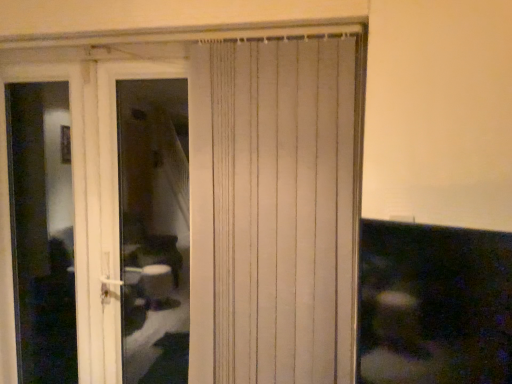
Image resolution: width=512 pixels, height=384 pixels. What do you see at coordinates (77, 216) in the screenshot?
I see `transparent glass screen door at left` at bounding box center [77, 216].

Where is `white textured curtain at center`? white textured curtain at center is located at coordinates (272, 212).

Describe the element at coordinates (154, 229) in the screenshot. I see `white plastic door at left` at that location.

Locate an element on the screen. transparent glass screen door at left is located at coordinates (77, 216).

Is white plastic door at left facing away from transparent glass screen door at left?

That's not correct — white plastic door at left is not looking away from transparent glass screen door at left.

Is white plastic door at left smaller than transparent glass screen door at left?

Actually, white plastic door at left might be larger than transparent glass screen door at left.

Is white plastic door at left next to transparent glass screen door at left?

No, white plastic door at left is not touching transparent glass screen door at left.

Does point (105, 176) come farther from viewer compared to point (219, 282)?

Yes, it is.

Measure the distance between transparent glass screen door at left and white textured curtain at center.

A distance of 69.51 centimeters exists between transparent glass screen door at left and white textured curtain at center.

Which is more to the left, transparent glass screen door at left or white textured curtain at center?

transparent glass screen door at left is more to the left.

Looking at this image, from a real-world perspective, is transparent glass screen door at left above or below white textured curtain at center?

Clearly, from a real-world perspective, transparent glass screen door at left is below white textured curtain at center.

From the image's perspective, is white plastic door at left on white textured curtain at center?

No, from the image's perspective, white plastic door at left is not over white textured curtain at center.

Considering the relative sizes of white plastic door at left and white textured curtain at center in the image provided, is white plastic door at left thinner than white textured curtain at center?

No.

In the image, there is a white textured curtain at center. Where is `window below it (from a real-world perspective)`? window below it (from a real-world perspective) is located at coordinates (154, 229).

Which is closer, (161,330) or (326,312)?

Positioned in front is point (326,312).

Can you tell me how much white textured curtain at center and transparent glass screen door at left differ in facing direction?

white textured curtain at center and transparent glass screen door at left are facing 0.00289 degrees away from each other.

Is white textured curtain at center in contact with transparent glass screen door at left?

No.

Is transparent glass screen door at left completely or partially inside white textured curtain at center?

No, transparent glass screen door at left is not surrounded by white textured curtain at center.

Which point is more distant from viewer, (224,43) or (79,291)?

The point (79,291) is behind.

Would you say white textured curtain at center contains white plastic door at left?

That's incorrect, white plastic door at left is not inside white textured curtain at center.

From a real-world perspective, which is physically above, white textured curtain at center or white plastic door at left?

In real-world perspective, white textured curtain at center is above.

Which object is positioned more to the left, white textured curtain at center or white plastic door at left?

white plastic door at left.

Between transparent glass screen door at left and white plastic door at left, which one has less height?

white plastic door at left.

Does transparent glass screen door at left appear on the left side of white plastic door at left?

Yes.

Does transparent glass screen door at left lie behind white plastic door at left?

Yes, the depth of transparent glass screen door at left is greater than that of white plastic door at left.

Where is `window above the transparent glass screen door at left (from a real-world perspective)`? window above the transparent glass screen door at left (from a real-world perspective) is located at coordinates (154, 229).

You are a GUI agent. You are given a task and a screenshot of the screen. Output one action in this format:
    pyautogui.click(x=<x>, y=<y>)
    Task: Click on the window in front of the transparent glass screen door at left
    Image resolution: width=512 pixels, height=384 pixels.
    Given the screenshot: What is the action you would take?
    pyautogui.click(x=154, y=229)

The image size is (512, 384). I want to click on screen door that appears below the white textured curtain at center (from a real-world perspective), so click(x=77, y=216).

Looking at this image, which object lies nearer to the anchor point white textured curtain at center, white plastic door at left or transparent glass screen door at left?

Among the two, transparent glass screen door at left is located nearer to white textured curtain at center.

In the scene shown: Based on their spatial positions, is transparent glass screen door at left or white textured curtain at center further from white plastic door at left?

white textured curtain at center lies further to white plastic door at left than the other object.

When comparing their distances from transparent glass screen door at left, does white textured curtain at center or white plastic door at left seem further?

white plastic door at left is positioned further to the anchor transparent glass screen door at left.

From the picture: Estimate the real-world distances between objects in this image. Which object is closer to white plastic door at left, white textured curtain at center or transparent glass screen door at left?

transparent glass screen door at left is closer to white plastic door at left.

Which object lies nearer to the anchor point transparent glass screen door at left, white plastic door at left or white textured curtain at center?

white textured curtain at center is closer to transparent glass screen door at left.

Based on their spatial positions, is transparent glass screen door at left or white plastic door at left closer to white textured curtain at center?

Based on the image, transparent glass screen door at left appears to be nearer to white textured curtain at center.

Image resolution: width=512 pixels, height=384 pixels. Identify the location of window between transparent glass screen door at left and white textured curtain at center from left to right. (154, 229).